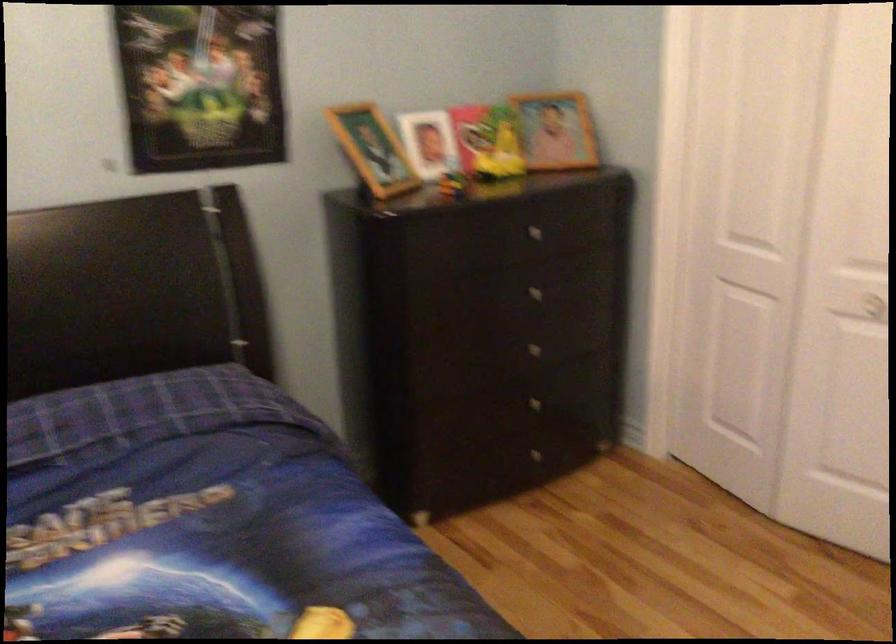
The image size is (896, 644). What do you see at coordinates (487, 142) in the screenshot? I see `the small colorful cube` at bounding box center [487, 142].